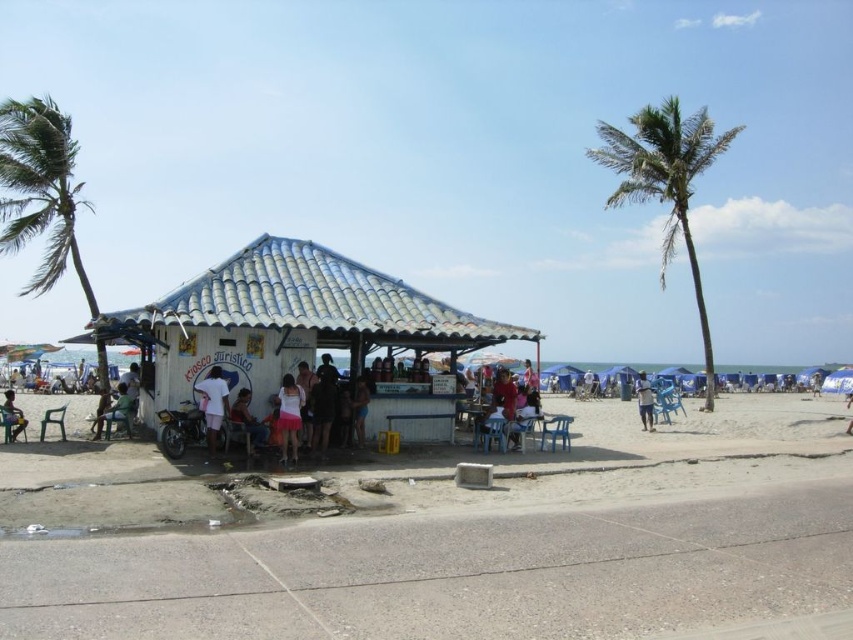
Question: Is white corrugated metal hut at center in front of blue plastic picnic table at center?

Choices:
 (A) no
 (B) yes

Answer: (B)

Question: Among these points, which one is nearest to the camera?

Choices:
 (A) (300, 420)
 (B) (210, 400)
 (C) (508, 436)
 (D) (248, 428)

Answer: (A)

Question: Does white matte shirt at center have a lesser width compared to matte blue shorts at center?

Choices:
 (A) yes
 (B) no

Answer: (B)

Question: Which point is farther to the camera?

Choices:
 (A) (546, 618)
 (B) (222, 384)
 (C) (283, 454)

Answer: (B)

Question: Does white matte shirt at center appear over matte red shirt at center?

Choices:
 (A) no
 (B) yes

Answer: (B)

Question: Which point is closer to the camera?

Choices:
 (A) (641, 403)
 (B) (115, 397)
 (C) (242, 396)
 (D) (621, 141)

Answer: (C)